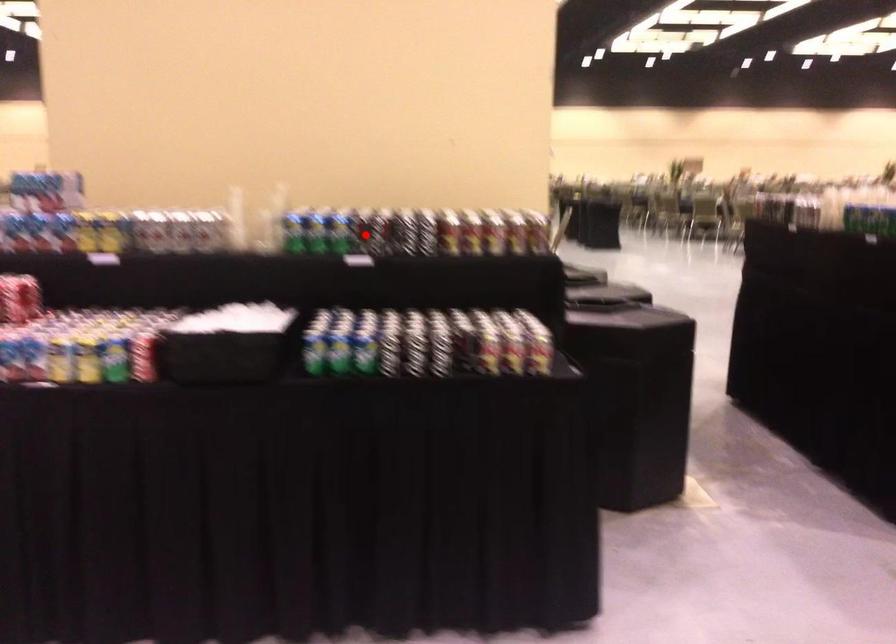
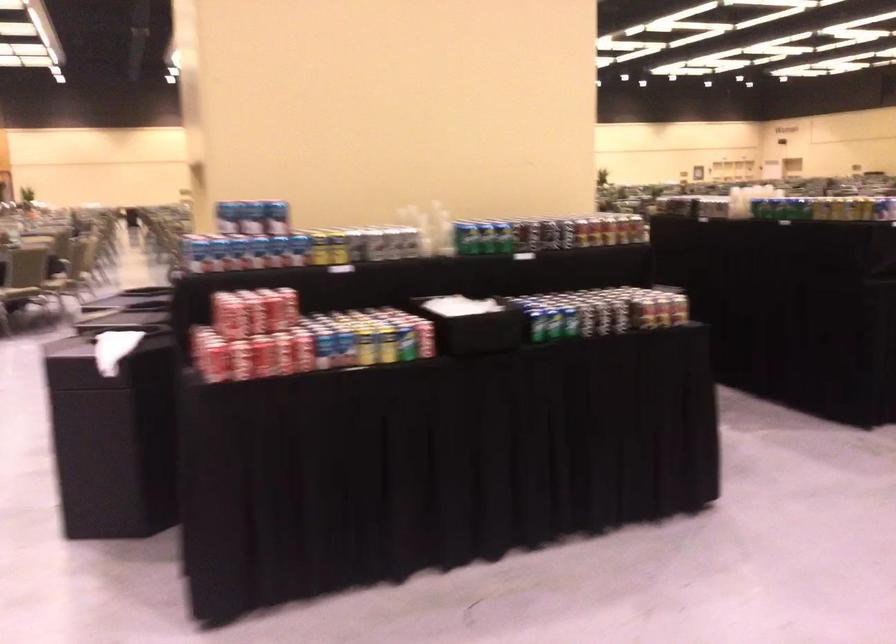
In the second image, find the point that corresponds to the highlighted location in the first image.

(530, 234)